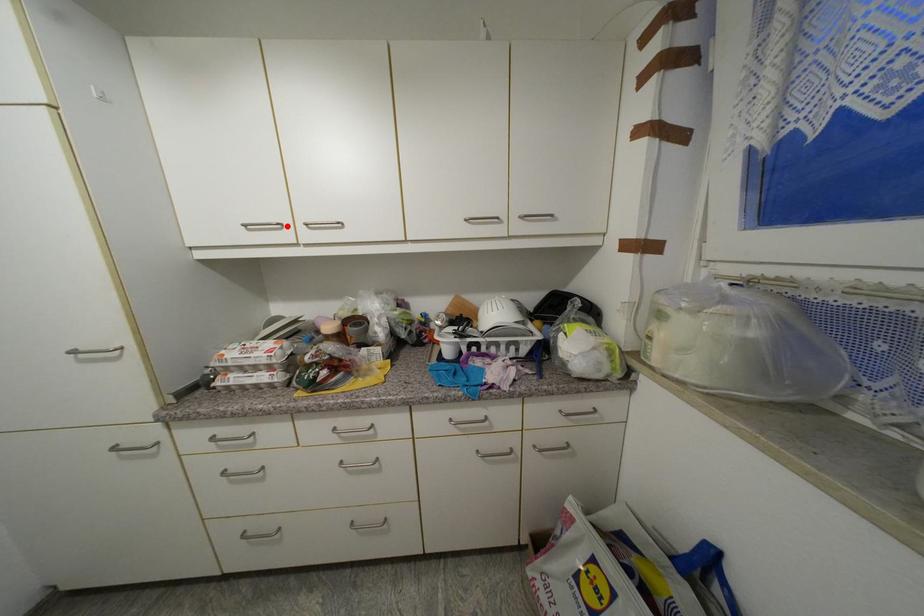
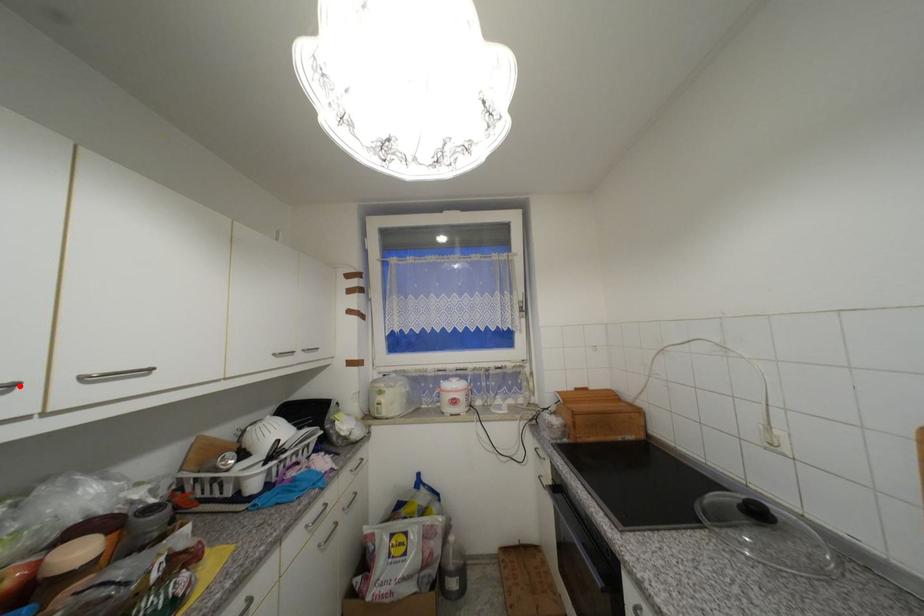
I am providing you with two images of the same scene from different viewpoints. A red point is marked on the first image and another point is marked on the second image. Do the highlighted points in image1 and image2 indicate the same real-world spot?

Yes